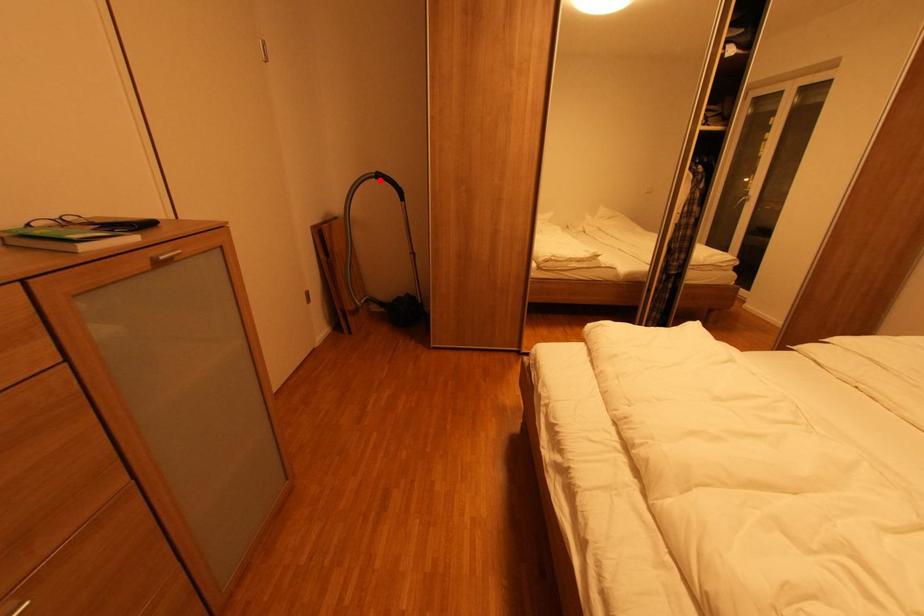
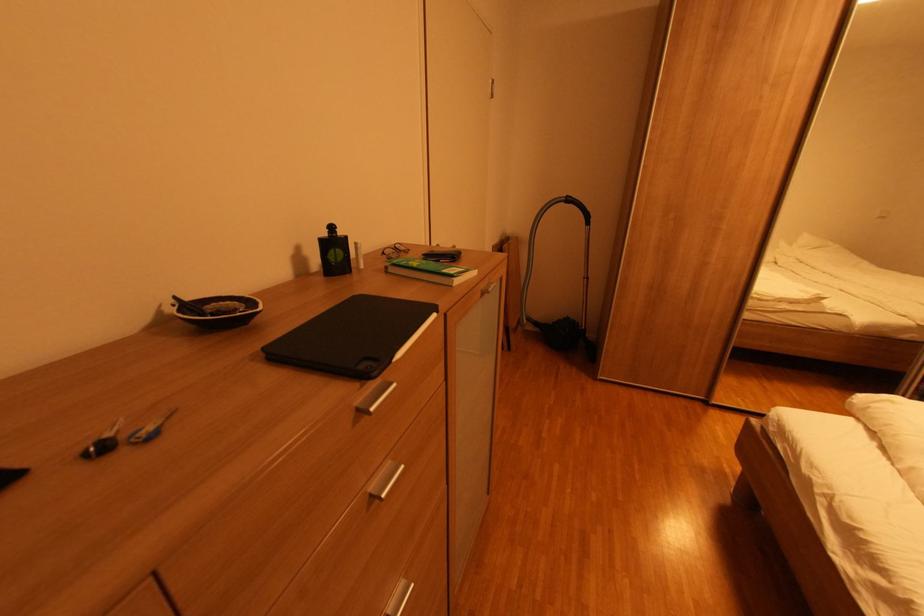
Find the pixel in the second image that matches the highlighted location in the first image.

(568, 205)